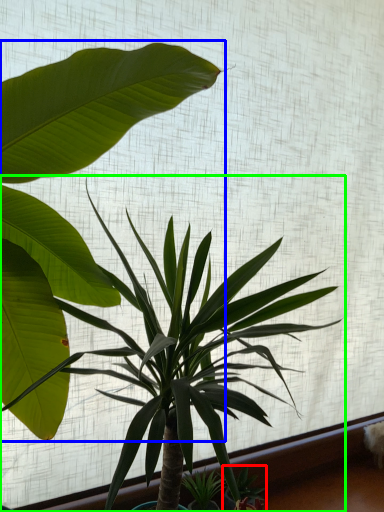
Question: Considering the real-world distances, which object is closest to plant (highlighted by a red box)? houseplant (highlighted by a blue box) or houseplant (highlighted by a green box).

Choices:
 (A) houseplant
 (B) houseplant

Answer: (B)